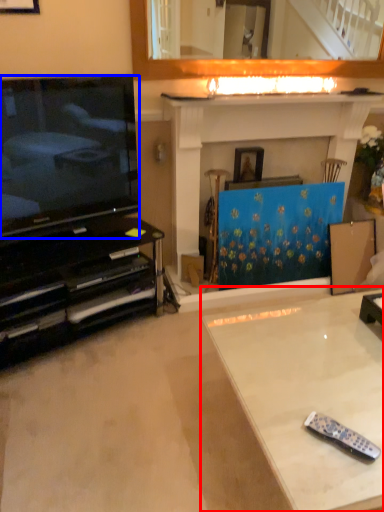
Question: Which object is closer to the camera taking this photo, table (highlighted by a red box) or television (highlighted by a blue box)?

Choices:
 (A) table
 (B) television

Answer: (A)